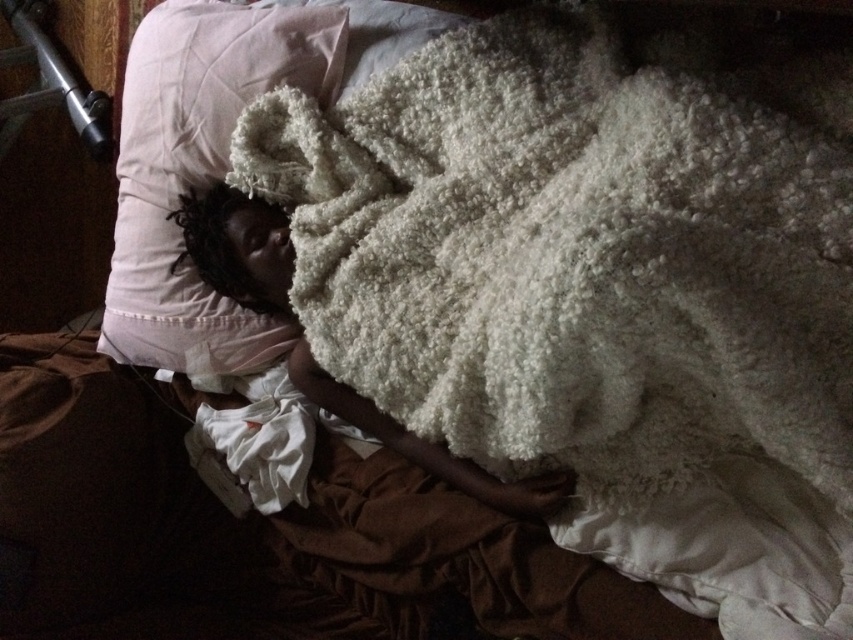
Question: Among these objects, which one is nearest to the camera?

Choices:
 (A) white soft pillow at upper left
 (B) white fluffy blanket at center

Answer: (B)

Question: Based on their relative distances, which object is farther from the white soft pillow at upper left?

Choices:
 (A) white fluffy blanket at center
 (B) white fluffy blanket at upper center

Answer: (B)

Question: Is white fluffy blanket at upper center in front of white soft pillow at upper left?

Choices:
 (A) yes
 (B) no

Answer: (A)

Question: Can you confirm if white fluffy blanket at upper center is bigger than white fluffy blanket at center?

Choices:
 (A) no
 (B) yes

Answer: (B)

Question: Can you confirm if white fluffy blanket at upper center is wider than white fluffy blanket at center?

Choices:
 (A) no
 (B) yes

Answer: (B)

Question: Which point is closer to the camera?

Choices:
 (A) (129, 340)
 (B) (244, 250)

Answer: (B)